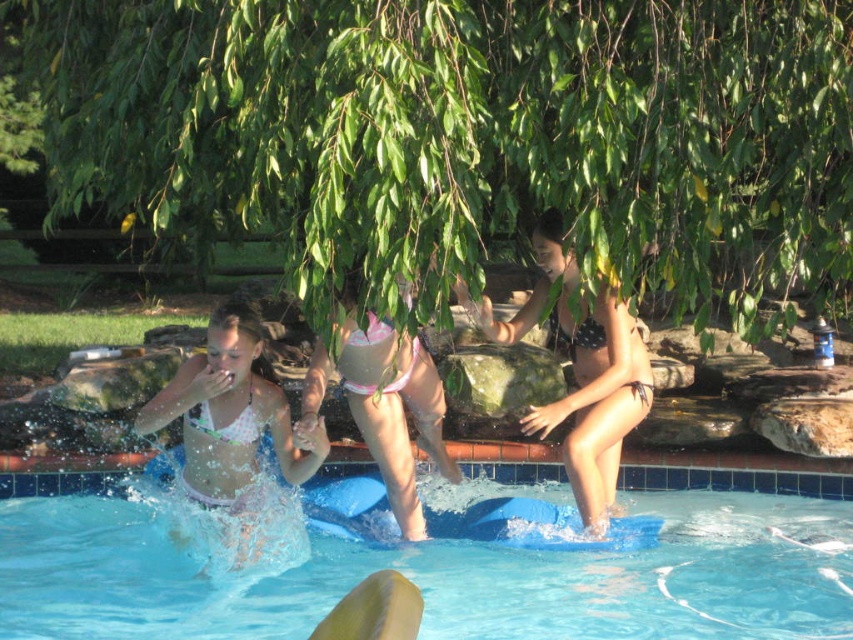
Question: Which point is closer to the camera taking this photo?

Choices:
 (A) (399, 340)
 (B) (169, 609)

Answer: (A)

Question: Which object is positioned farthest from the polka dot bikini at center?

Choices:
 (A) white matte bikini at lower left
 (B) blue rubber board at center
 (C) pink fabric bikini at center
 (D) green leafy tree at upper center

Answer: (A)

Question: Which object is positioned closest to the pink fabric bikini at center?

Choices:
 (A) white matte bikini at lower left
 (B) polka dot bikini at center
 (C) green leafy tree at upper center

Answer: (A)

Question: Is green leafy tree at upper center to the left of polka dot bikini at center from the viewer's perspective?

Choices:
 (A) no
 (B) yes

Answer: (B)

Question: Can you confirm if blue rubber board at center is positioned to the left of polka dot bikini at center?

Choices:
 (A) no
 (B) yes

Answer: (B)

Question: Does blue rubber board at center appear on the left side of pink fabric bikini at center?

Choices:
 (A) no
 (B) yes

Answer: (A)